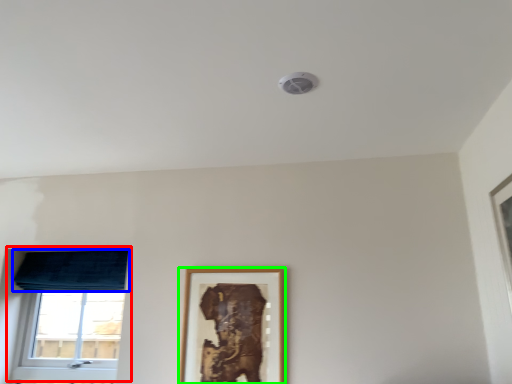
Question: Which object is the closest to the window (highlighted by a red box)? Choose among these: curtain (highlighted by a blue box) or picture frame (highlighted by a green box).

Choices:
 (A) curtain
 (B) picture frame

Answer: (A)